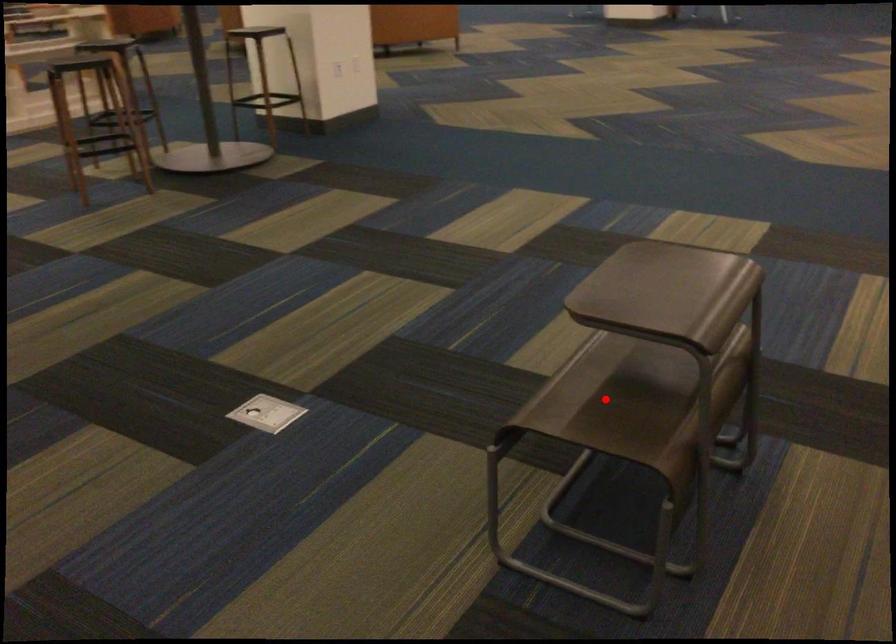
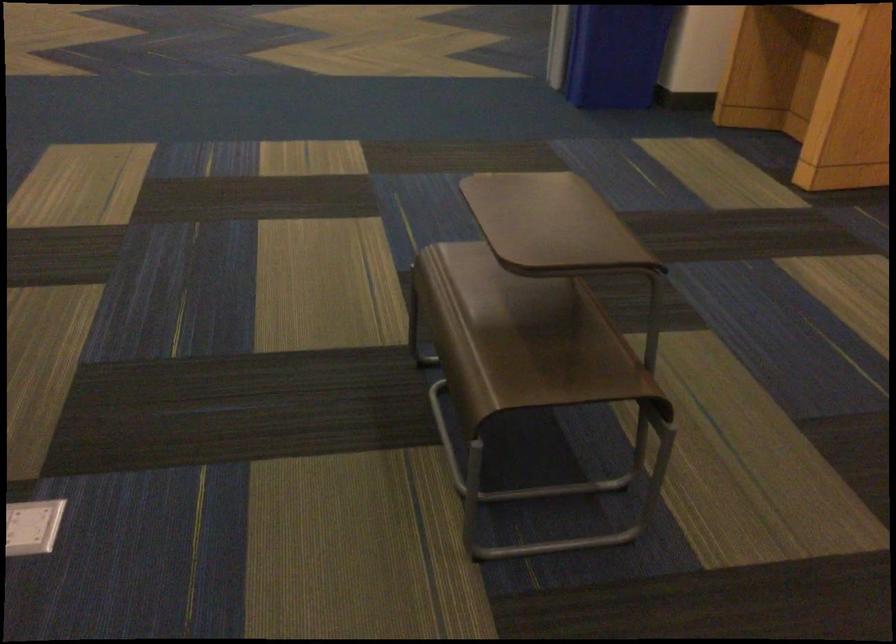
The point at the highlighted location is marked in the first image. Where is the corresponding point in the second image?

(531, 346)